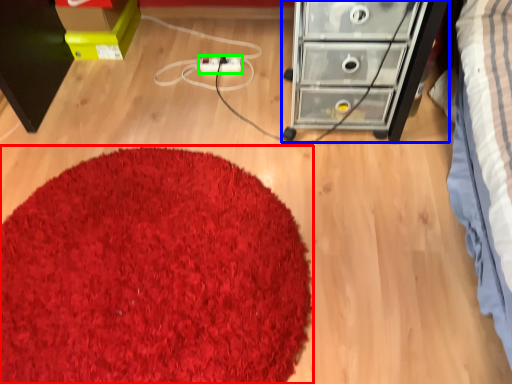
Question: Considering the real-world distances, which object is closest to mat (highlighted by a red box)? chest of drawers (highlighted by a blue box) or extension cord (highlighted by a green box).

Choices:
 (A) chest of drawers
 (B) extension cord

Answer: (A)